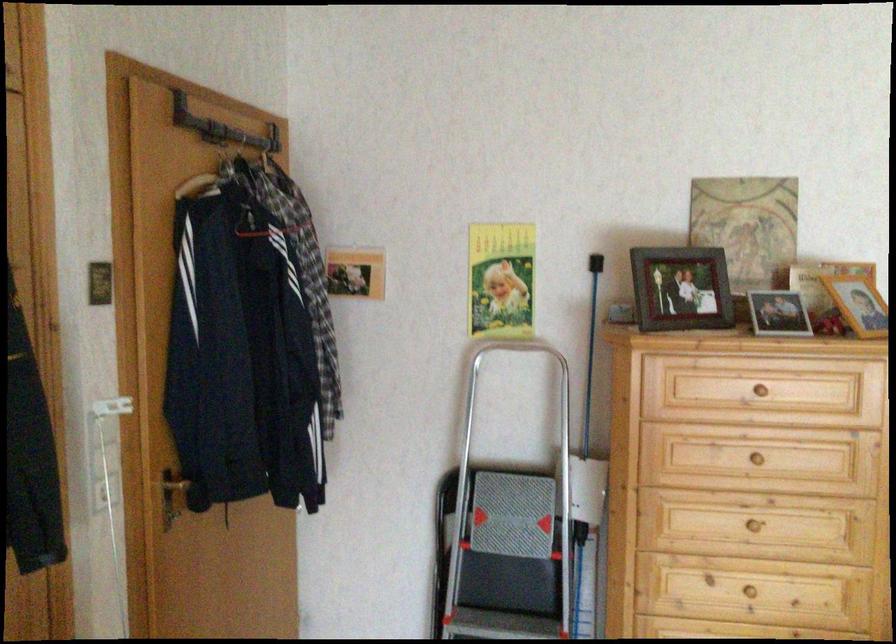
I want to click on over-the-door rack, so click(x=222, y=128).